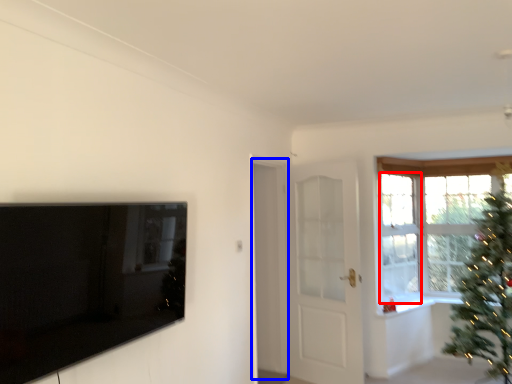
Question: Among these objects, which one is farthest to the camera, window (highlighted by a red box) or screen door (highlighted by a blue box)?

Choices:
 (A) window
 (B) screen door

Answer: (A)